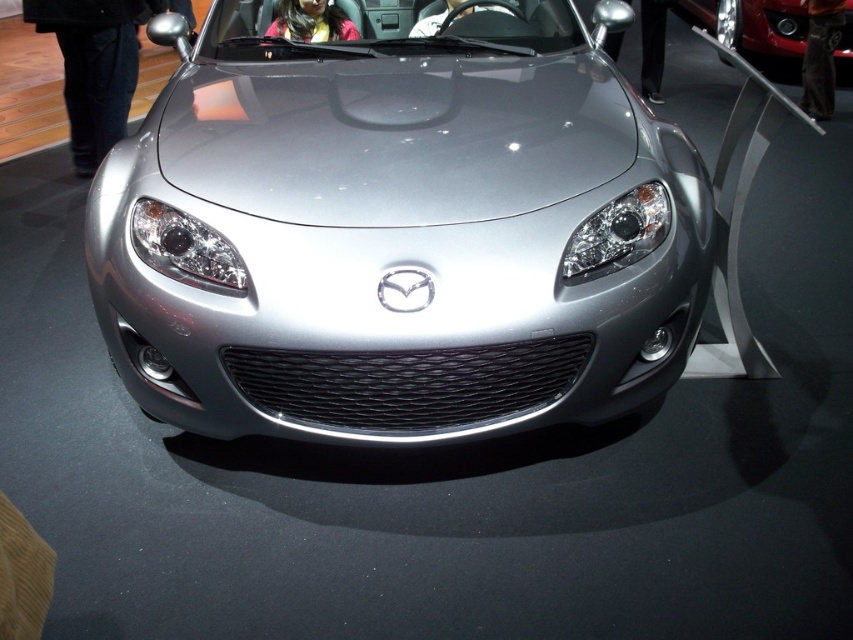
Question: Which object appears closest to the camera in this image?

Choices:
 (A) satin silver car at center
 (B) metallic silver car at center

Answer: (A)

Question: Which object is closer to the camera taking this photo?

Choices:
 (A) metallic silver car at center
 (B) satin silver car at center

Answer: (B)

Question: Does metallic silver car at center have a greater width compared to satin silver car at center?

Choices:
 (A) yes
 (B) no

Answer: (A)

Question: Does metallic silver car at center lie in front of satin silver car at center?

Choices:
 (A) yes
 (B) no

Answer: (B)

Question: Can you confirm if metallic silver car at center is thinner than satin silver car at center?

Choices:
 (A) no
 (B) yes

Answer: (A)